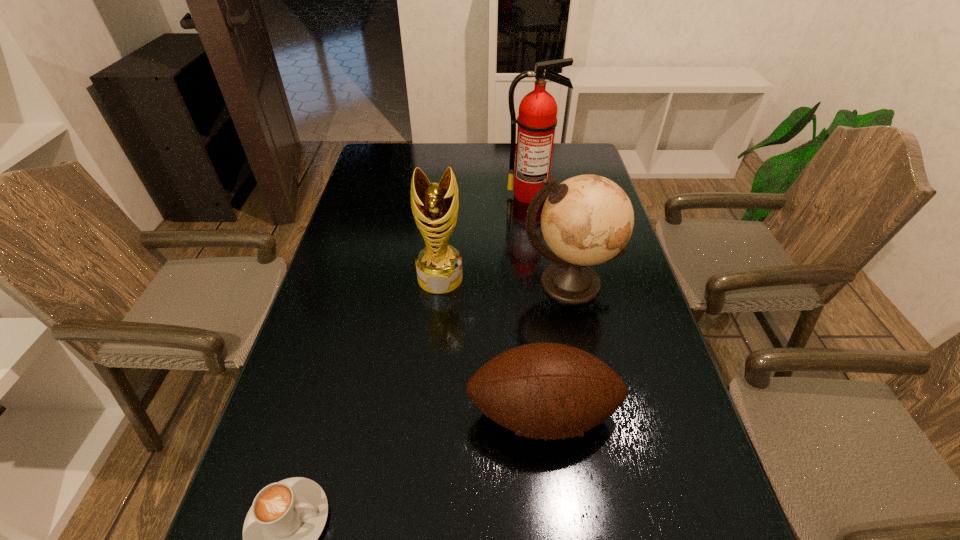
Find the location of `globe present at the right edge`. globe present at the right edge is located at coordinates (587, 220).

The width and height of the screenshot is (960, 540). What are the coordinates of `football present at the right edge` in the screenshot? It's located at (545, 391).

In the image, there is a desktop. At what (x,y) coordinates should I click in order to perform the action: click on vacant space at the far edge. Please return your answer as a coordinate pair (x, y). This screenshot has height=540, width=960. Looking at the image, I should click on (464, 145).

Image resolution: width=960 pixels, height=540 pixels. I want to click on vacant area at the left edge, so click(343, 225).

Locate an element on the screen. The height and width of the screenshot is (540, 960). vacant space at the far left corner is located at coordinates (399, 166).

I want to click on free space at the far right corner of the desktop, so tap(568, 173).

Image resolution: width=960 pixels, height=540 pixels. In order to click on free spot between the globe and the second object from left to right in this screenshot , I will do `click(504, 280)`.

Image resolution: width=960 pixels, height=540 pixels. Identify the location of free space that is in between the farthest object and the second nearest object. (537, 304).

Where is `free space between the fourth object from right to left and the globe`? free space between the fourth object from right to left and the globe is located at coordinates (504, 280).

Identify the location of vacant space in between the award and the farthest object. The height and width of the screenshot is (540, 960). (486, 236).